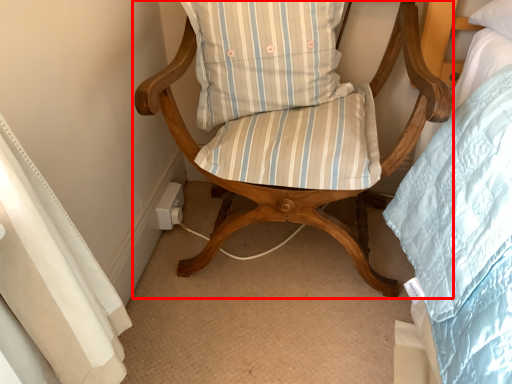
Question: From the image's perspective, considering the relative positions of chair (annotated by the red box) and pillow in the image provided, where is chair (annotated by the red box) located with respect to the staircase?

Choices:
 (A) above
 (B) below

Answer: (B)